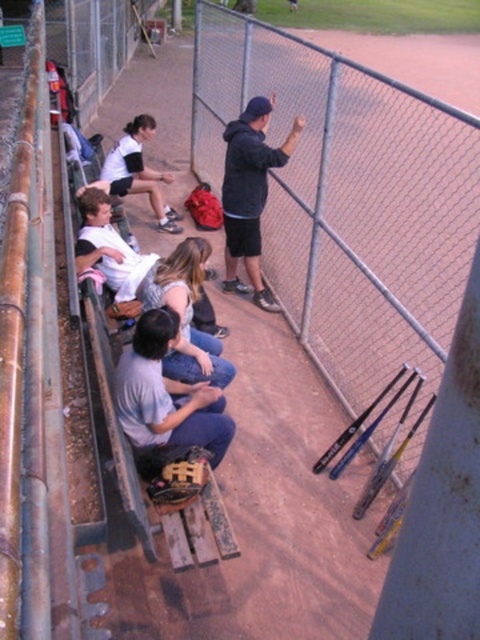
You are a photographer trying to capture a candid shot of the players in the dugout. You have a camera with a lens that can focus on objects up to 2 meters away. The white matte shirt at upper left is 1.8 meters away from your current position. Can you clearly capture the white cotton shirt at center in the same shot without moving?

The white matte shirt at upper left is 1.8 meters away from you, which is within the camera lens range. Since the white cotton shirt at center is closer than the white matte shirt at upper left, it is also within the 2 meters range. Therefore, you can capture both shirts clearly in the same shot without moving.

You are a coach standing in the dugout and need to retrieve the black matte bat at upper center. However, the dark gray hoodie at upper center is blocking your access. Can you move the hoodie to get the bat?

The dark gray hoodie at upper center is in front of the black matte bat at upper center, so you can move the hoodie to access the bat.

You are a coach standing in the dugout and need to quickly grab the black matte bat at upper center from the dark gray hoodie at upper center. Can you reach it without moving from your current position?

The distance between the dark gray hoodie at upper center and the black matte bat at upper center is 17.08 meters, which is quite far. You cannot reach the bat without moving from your current position.